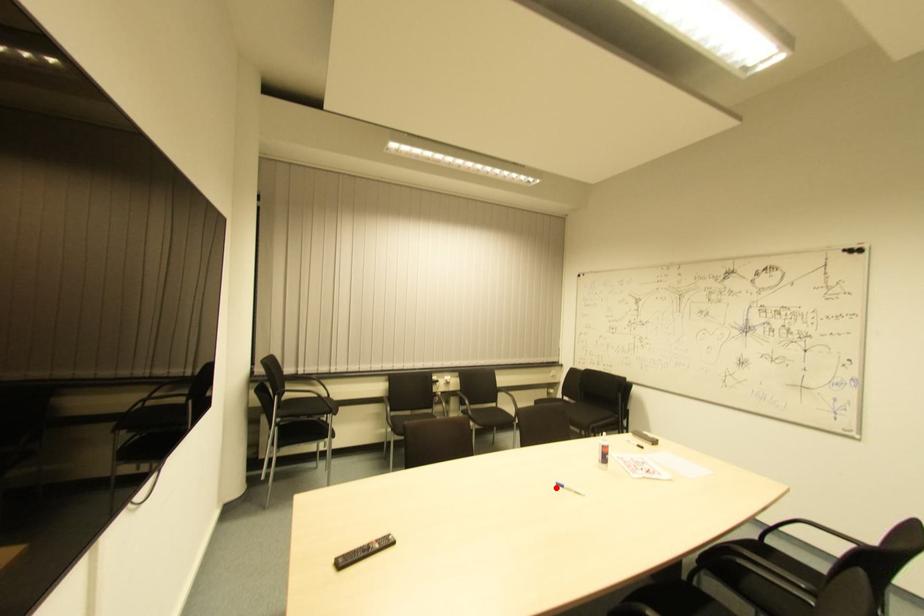
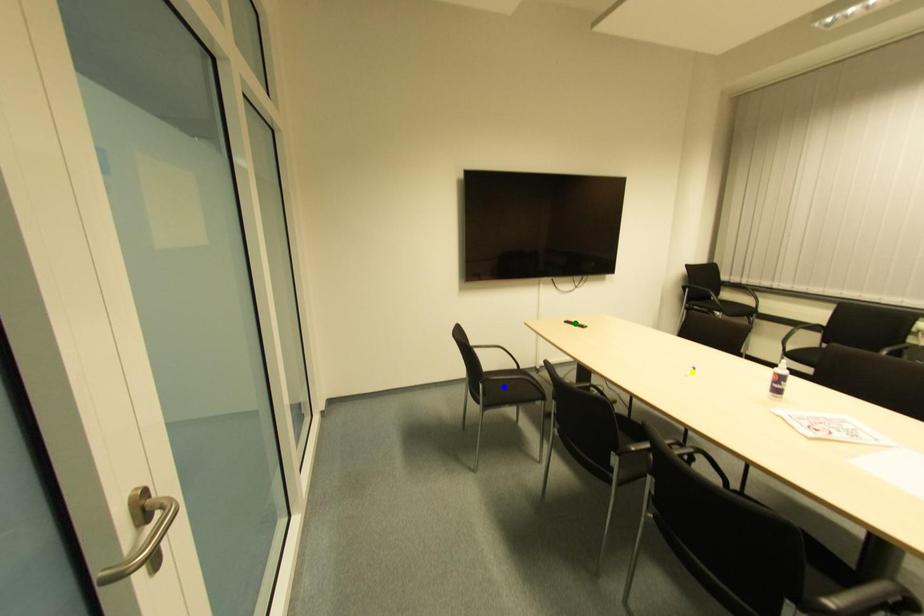
Question: I am providing you with two images of the same scene from different viewpoints. A red point is marked on the first image. You are given multiple points on the second image. Which mark in image 2 goes with the point in image 1?

Choices:
 (A) yellow point
 (B) blue point
 (C) green point

Answer: (A)